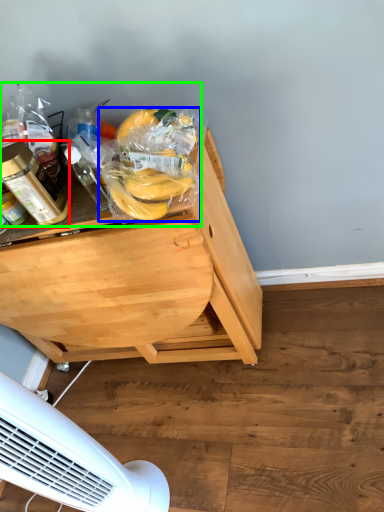
Question: Considering the real-world distances, which object is farthest from bottle (highlighted by a red box)? food (highlighted by a blue box) or food (highlighted by a green box)?

Choices:
 (A) food
 (B) food

Answer: (A)